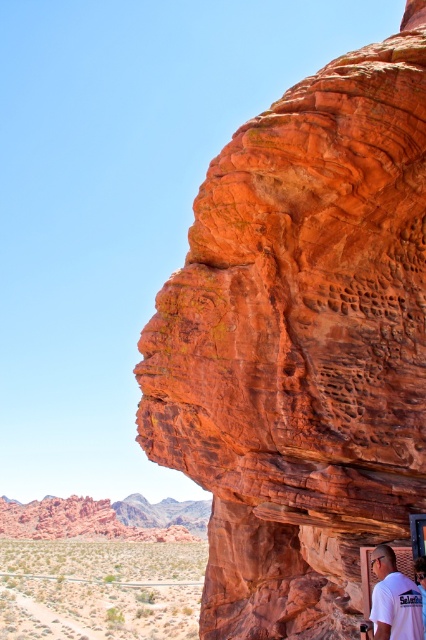
Question: Which point is closer to the camera taking this photo?

Choices:
 (A) (83, 596)
 (B) (206, 184)
 (C) (370, 627)

Answer: (C)

Question: Does desertdry/dusty at lower left have a lesser width compared to white t-shirt at lower right?

Choices:
 (A) yes
 (B) no

Answer: (B)

Question: Among these points, which one is nearest to the camera?

Choices:
 (A) (20, 580)
 (B) (412, 600)
 (C) (264, 324)

Answer: (B)

Question: Observing the image, what is the correct spatial positioning of desertdry/dusty at lower left in reference to white t-shirt at lower right?

Choices:
 (A) above
 (B) below

Answer: (B)

Question: Which of the following is the closest to the observer?

Choices:
 (A) white t-shirt at lower right
 (B) desertdry/dusty at lower left
 (C) rustic sandstone face at right

Answer: (A)

Question: Does desertdry/dusty at lower left appear over white t-shirt at lower right?

Choices:
 (A) no
 (B) yes

Answer: (A)